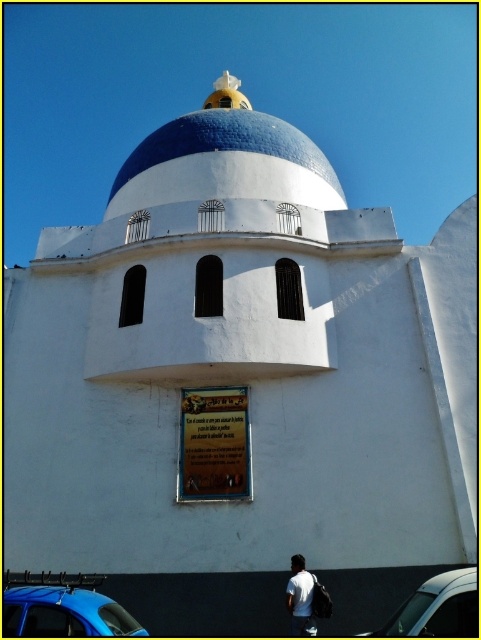
Question: Is blue tiled dome at upper center wider than metallic silver car at lower right?

Choices:
 (A) no
 (B) yes

Answer: (B)

Question: Among these points, which one is nearest to the camera?

Choices:
 (A) pyautogui.click(x=40, y=621)
 (B) pyautogui.click(x=199, y=177)
 (C) pyautogui.click(x=422, y=593)

Answer: (A)

Question: Which of the following is the farthest from the observer?

Choices:
 (A) white matte shirt at lower center
 (B) metallic silver car at lower right
 (C) blue tiled dome at upper center

Answer: (C)

Question: Which of these objects is positioned farthest from the white matte shirt at lower center?

Choices:
 (A) blue tiled dome at upper center
 (B) metallic blue car at lower left
 (C) metallic silver car at lower right

Answer: (A)

Question: Is metallic blue car at lower left positioned before metallic silver car at lower right?

Choices:
 (A) no
 (B) yes

Answer: (A)

Question: Does metallic blue car at lower left appear on the right side of metallic silver car at lower right?

Choices:
 (A) no
 (B) yes

Answer: (A)